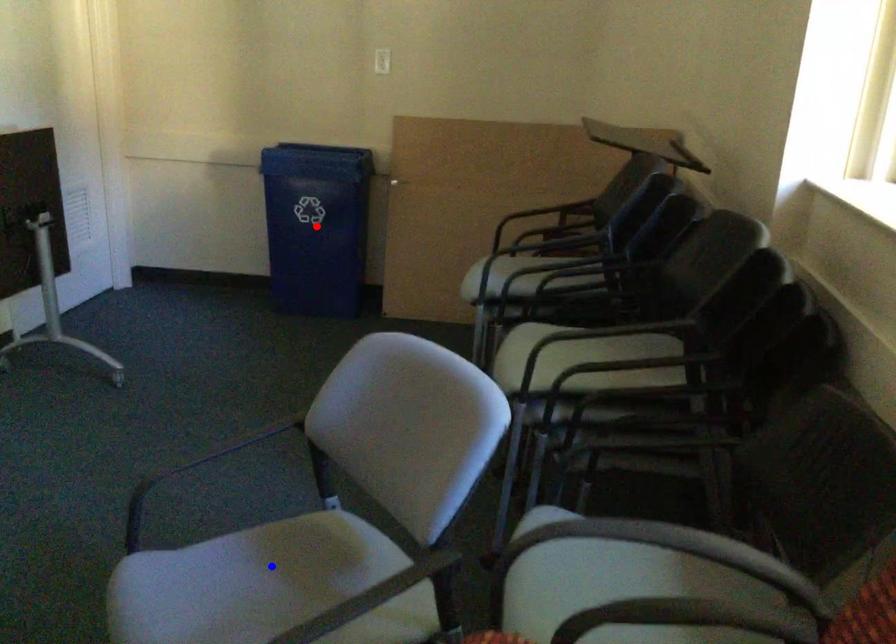
Question: Two points are marked on the image. Which point is closer to the camera?

Choices:
 (A) Blue point is closer.
 (B) Red point is closer.

Answer: (A)